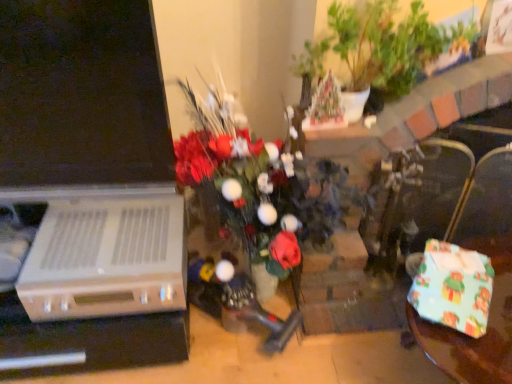
This screenshot has width=512, height=384. In order to click on free space in front of wrapping paper gift at lower right in this screenshot , I will do `click(470, 348)`.